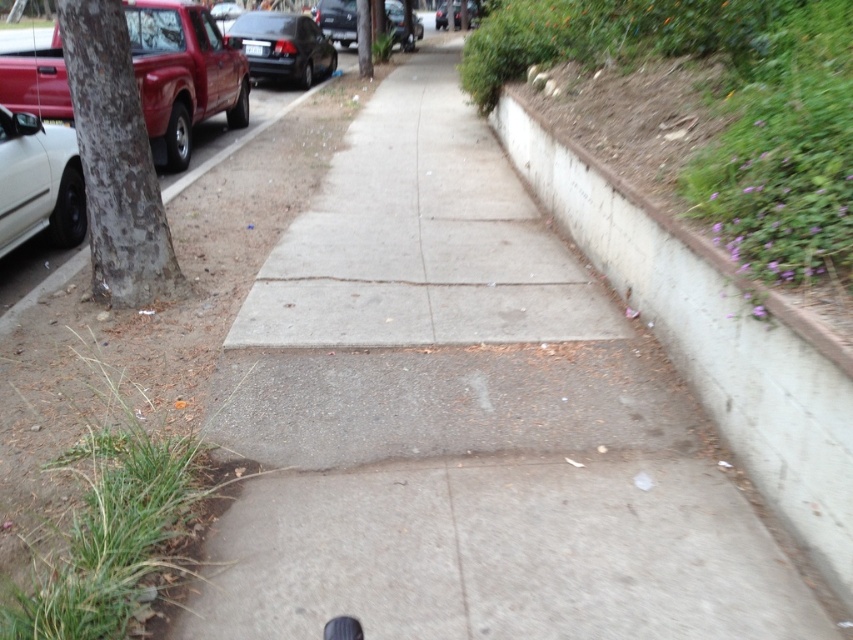
Who is shorter, matte red truck at left or shiny black car at upper left?

Standing shorter between the two is matte red truck at left.

Is matte red truck at left wider than shiny black car at upper left?

Incorrect, matte red truck at left's width does not surpass shiny black car at upper left's.

Does point (19, 84) come farther from viewer compared to point (291, 72)?

That is False.

Identify the location of matte red truck at left. (183, 74).

How much distance is there between metallic gray car at upper center and black rubber shoe at lower center?

A distance of 67.31 feet exists between metallic gray car at upper center and black rubber shoe at lower center.

Between metallic gray car at upper center and black rubber shoe at lower center, which one is positioned lower?

Positioned lower is black rubber shoe at lower center.

Is point (329, 8) positioned in front of point (335, 628)?

No, (329, 8) is behind (335, 628).

Locate an element on the screen. metallic gray car at upper center is located at coordinates (337, 19).

Does matte red truck at left appear under black rubber shoe at lower center?

Actually, matte red truck at left is above black rubber shoe at lower center.

Which is more to the right, matte red truck at left or black rubber shoe at lower center?

Positioned to the right is black rubber shoe at lower center.

Does point (239, 54) lie in front of point (340, 630)?

No, (239, 54) is behind (340, 630).

Image resolution: width=853 pixels, height=640 pixels. I want to click on matte red truck at left, so click(x=183, y=74).